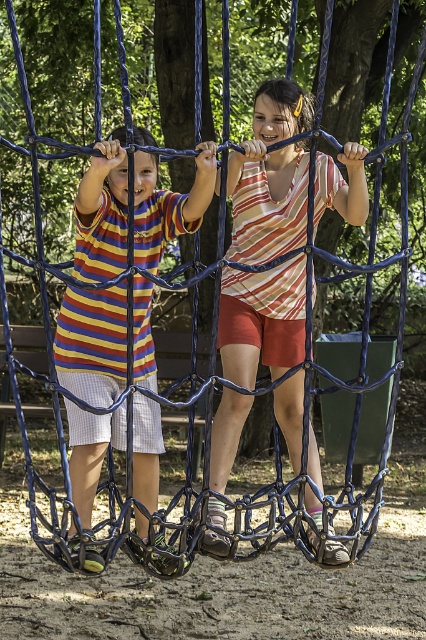
Who is higher up, striped cotton shirt at center or matte striped shirt at left?

striped cotton shirt at center is above.

Can you confirm if striped cotton shirt at center is smaller than matte striped shirt at left?

Incorrect, striped cotton shirt at center is not smaller in size than matte striped shirt at left.

Where is `striped cotton shirt at center`? The height and width of the screenshot is (640, 426). striped cotton shirt at center is located at coordinates (270, 177).